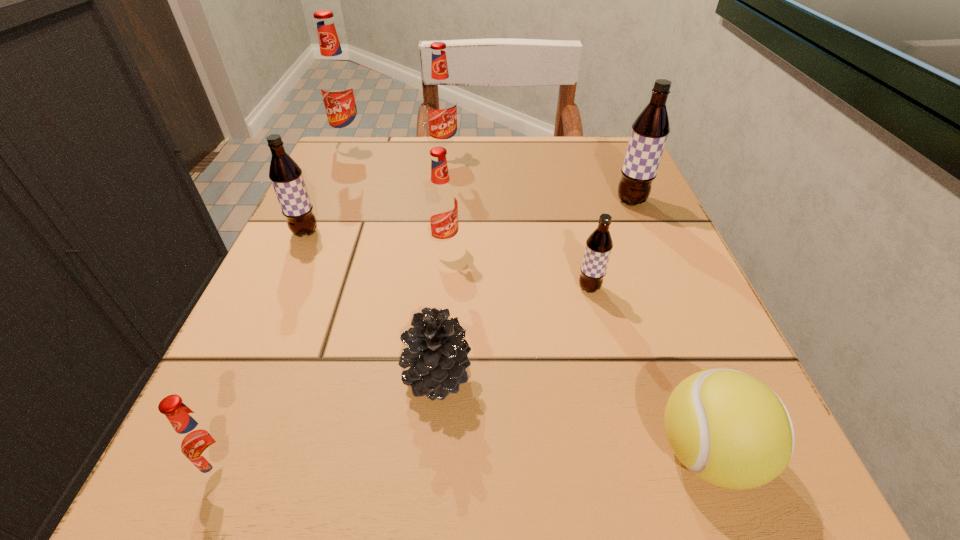
What are the coordinates of `free space at the far edge of the desktop` in the screenshot? It's located at (521, 138).

The image size is (960, 540). Identify the location of free space at the near edge of the desktop. (565, 508).

The image size is (960, 540). I want to click on vacant position at the left edge of the desktop, so click(x=340, y=305).

This screenshot has height=540, width=960. In order to click on vacant space at the right edge in this screenshot , I will do `click(624, 273)`.

This screenshot has height=540, width=960. In the image, there is a desktop. In order to click on vacant space at the far left corner in this screenshot , I will do `click(329, 184)`.

Locate an element on the screen. The image size is (960, 540). vacant area at the far right corner of the desktop is located at coordinates (618, 142).

Image resolution: width=960 pixels, height=540 pixels. Identify the location of free spot between the second biggest red root beer and the smallest red root beer. (336, 310).

Find the location of a particular element. free spot between the seventh nearest object and the second biggest red root beer is located at coordinates (538, 176).

Identify the location of free area in between the seventh object from left to right and the brown pinecone. The width and height of the screenshot is (960, 540). (513, 332).

You are a GUI agent. You are given a task and a screenshot of the screen. Output one action in this format:
    pyautogui.click(x=<x>, y=<y>)
    Task: Click on the vacant point located between the brown pinecone and the tennis ball
    
    Given the screenshot: What is the action you would take?
    pyautogui.click(x=571, y=414)